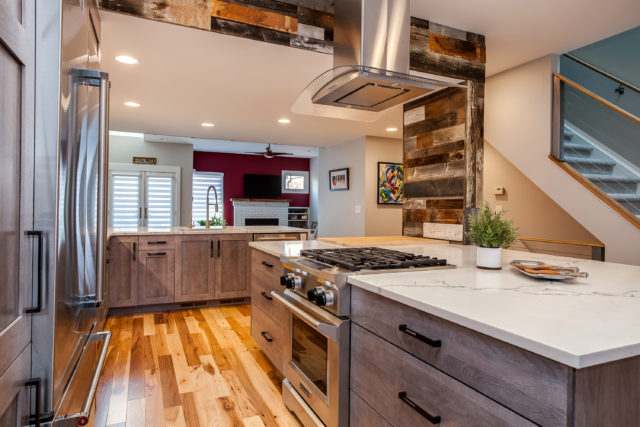
The image size is (640, 427). I want to click on kitchen counter drawers, so click(x=361, y=411), click(x=381, y=366), click(x=385, y=313), click(x=258, y=268), click(x=256, y=296), click(x=259, y=340).